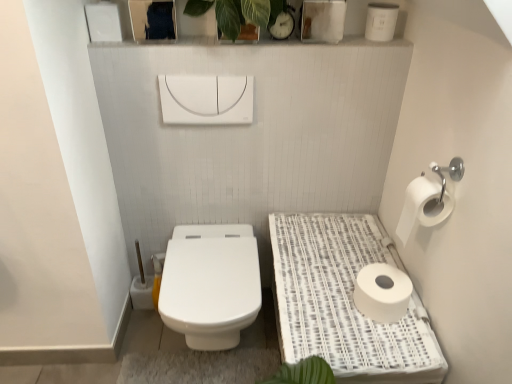
Find the location of `vacant space in front of white matte toilet paper at lower right, placed as the 2th toilet paper when sorted from top to bottom`. vacant space in front of white matte toilet paper at lower right, placed as the 2th toilet paper when sorted from top to bottom is located at coordinates (391, 348).